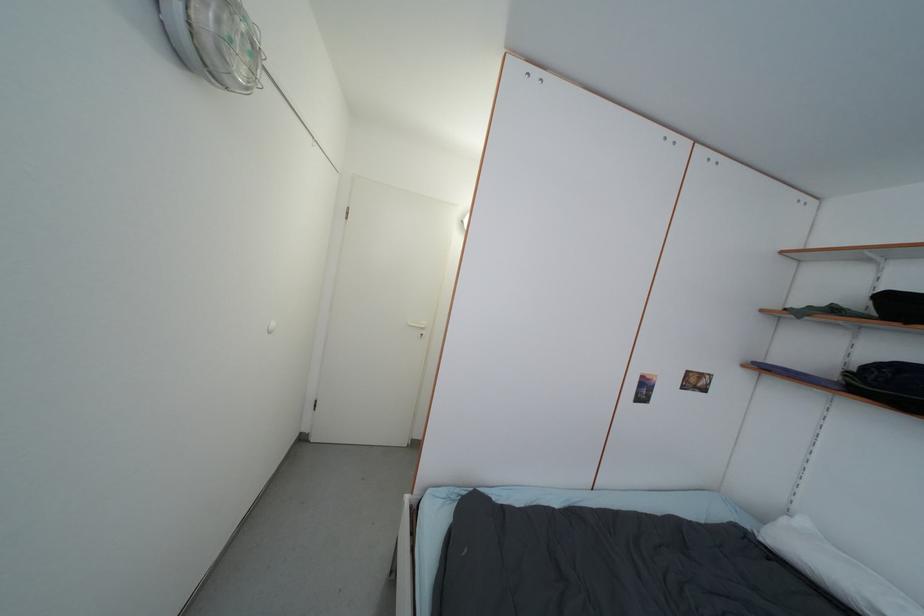
You are a GUI agent. You are given a task and a screenshot of the screen. Output one action in this format:
    pyautogui.click(x=<x>, y=<y>)
    Task: Click on the white light switch
    
    Given the screenshot: What is the action you would take?
    pyautogui.click(x=271, y=326)